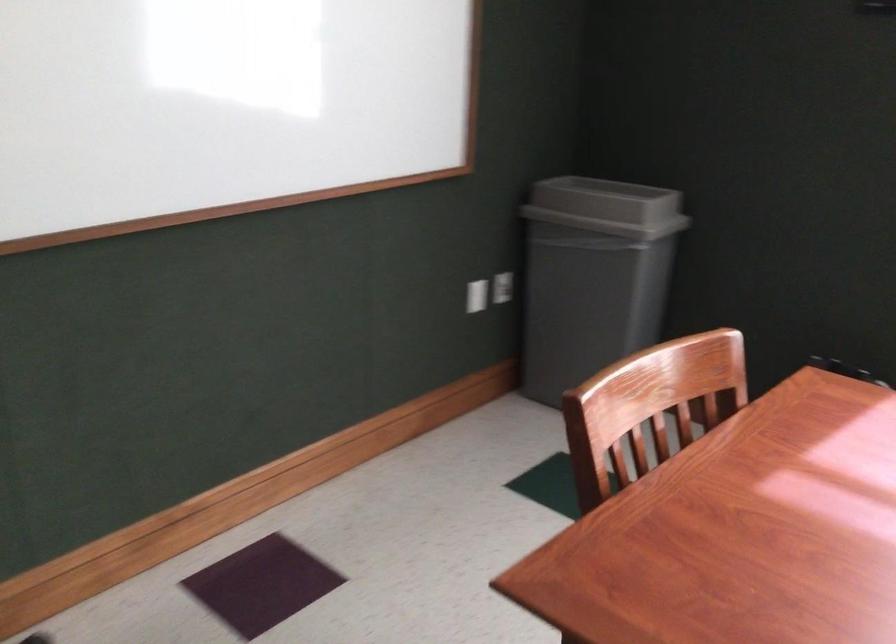
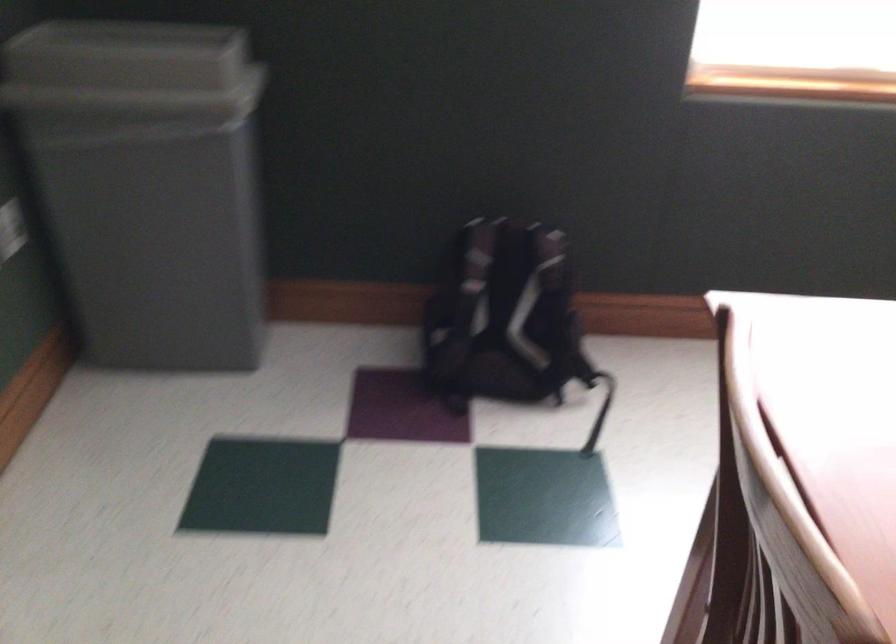
The images are taken continuously from a first-person perspective. In which direction is your viewpoint rotating?

The camera's rotation is toward right-down.